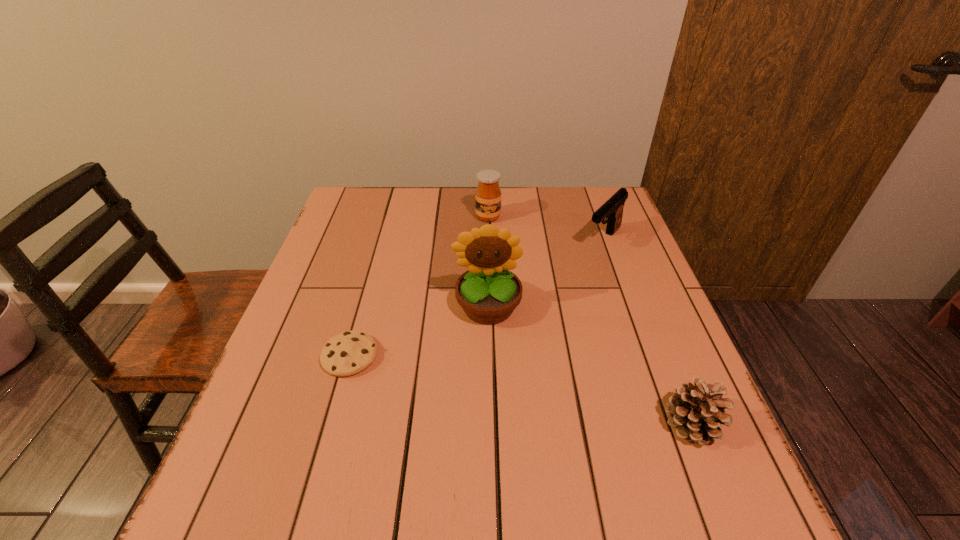
The height and width of the screenshot is (540, 960). What are the coordinates of `pistol at the far edge` in the screenshot? It's located at (612, 209).

At what (x,y) coordinates should I click in order to perform the action: click on object that is at the near edge. Please return your answer as a coordinate pair (x, y). The width and height of the screenshot is (960, 540). Looking at the image, I should click on (697, 411).

Locate an element on the screen. The height and width of the screenshot is (540, 960). object located at the left edge is located at coordinates (350, 352).

Locate an element on the screen. The height and width of the screenshot is (540, 960). pinecone at the right edge is located at coordinates (697, 411).

Identify the location of pistol present at the right edge. [612, 209].

I want to click on object present at the far right corner, so click(x=612, y=209).

Find the location of a particular element. object at the near right corner is located at coordinates (697, 411).

Identify the location of free space at the far edge of the desktop. (507, 222).

In the image, there is a desktop. At what (x,y) coordinates should I click in order to perform the action: click on vacant region at the near edge. Please return your answer as a coordinate pair (x, y). The image size is (960, 540). Looking at the image, I should click on (403, 441).

In the image, there is a desktop. In order to click on free region at the left edge in this screenshot , I will do `click(354, 320)`.